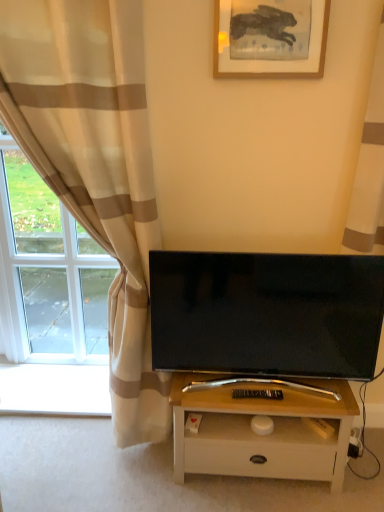
This screenshot has height=512, width=384. Identify the location of vacant area situated below black glossy tv at center (from a real-world perspective). (266, 389).